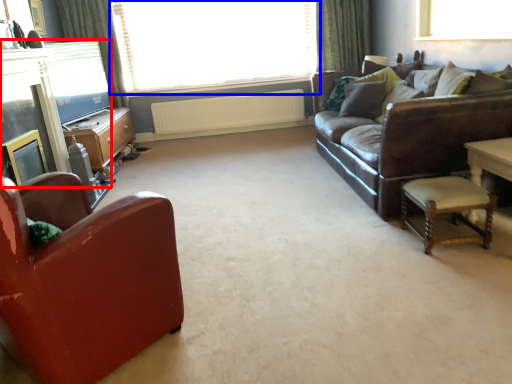
Question: Which object appears farthest to the camera in this image, fireplace (highlighted by a red box) or window (highlighted by a blue box)?

Choices:
 (A) fireplace
 (B) window

Answer: (B)